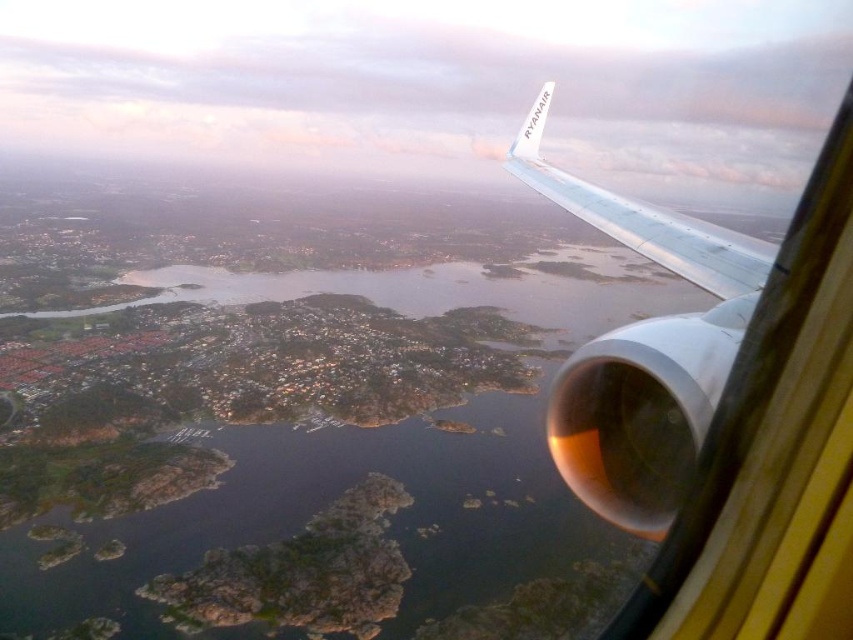
Based on the photo, is greenish-blue water at center thinner than white metallic wing at upper right?

No.

How much distance is there between greenish-blue water at center and white metallic wing at upper right?

They are 412.62 meters apart.

Locate an element on the screen. The width and height of the screenshot is (853, 640). greenish-blue water at center is located at coordinates (308, 456).

Between metallic silver wing at upper right and white metallic wing at upper right, which one is positioned lower?

Positioned lower is metallic silver wing at upper right.

Which is in front, point (637, 339) or point (727, 276)?

Point (637, 339) is in front.

Where is `metallic silver wing at upper right`? Image resolution: width=853 pixels, height=640 pixels. metallic silver wing at upper right is located at coordinates point(642,349).

Between point (602, 257) and point (640, 387), which one is positioned behind?

Positioned behind is point (602, 257).

Image resolution: width=853 pixels, height=640 pixels. Describe the element at coordinates (308, 456) in the screenshot. I see `greenish-blue water at center` at that location.

You are a GUI agent. You are given a task and a screenshot of the screen. Output one action in this format:
    pyautogui.click(x=<x>, y=<y>)
    Task: Click on the greenish-blue water at center
    This screenshot has height=640, width=853.
    Given the screenshot: What is the action you would take?
    pyautogui.click(x=308, y=456)